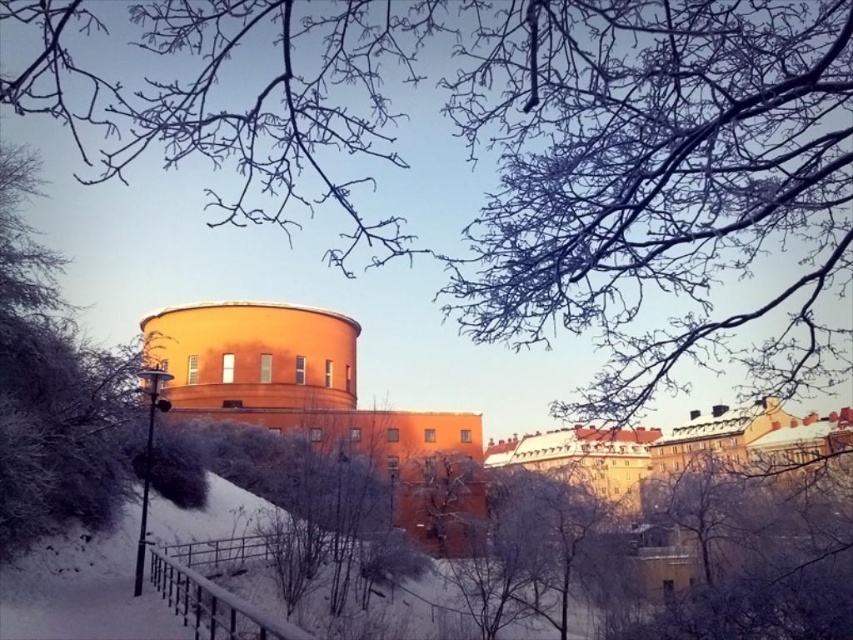
Does frosty branches at upper center have a smaller size compared to frosty bark tree at center?

Actually, frosty branches at upper center might be larger than frosty bark tree at center.

Between frosty branches at upper center and frosty bark tree at center, which one is positioned lower?

frosty bark tree at center

Who is more distant from viewer, [560,243] or [448,508]?

The point [448,508] is more distant.

Identify the location of frosty branches at upper center. Image resolution: width=853 pixels, height=640 pixels. [x=514, y=157].

Between snow-covered branches at left and frosty bark tree at center, which one is positioned higher?

snow-covered branches at left is higher up.

Does snow-covered branches at left appear under frosty bark tree at center?

Actually, snow-covered branches at left is above frosty bark tree at center.

Is point (96, 525) closer to viewer compared to point (395, 488)?

Yes.

Locate an element on the screen. snow-covered branches at left is located at coordinates (51, 388).

In the scene shown: Who is lower down, frosty branches at upper center or snow-covered branches at left?

snow-covered branches at left is lower down.

How much distance is there between frosty branches at upper center and snow-covered branches at left?

A distance of 27.74 feet exists between frosty branches at upper center and snow-covered branches at left.

Is point (838, 216) farther from viewer compared to point (22, 499)?

No, (838, 216) is closer to viewer.

Find the location of a particular element. The width and height of the screenshot is (853, 640). frosty branches at upper center is located at coordinates (514, 157).